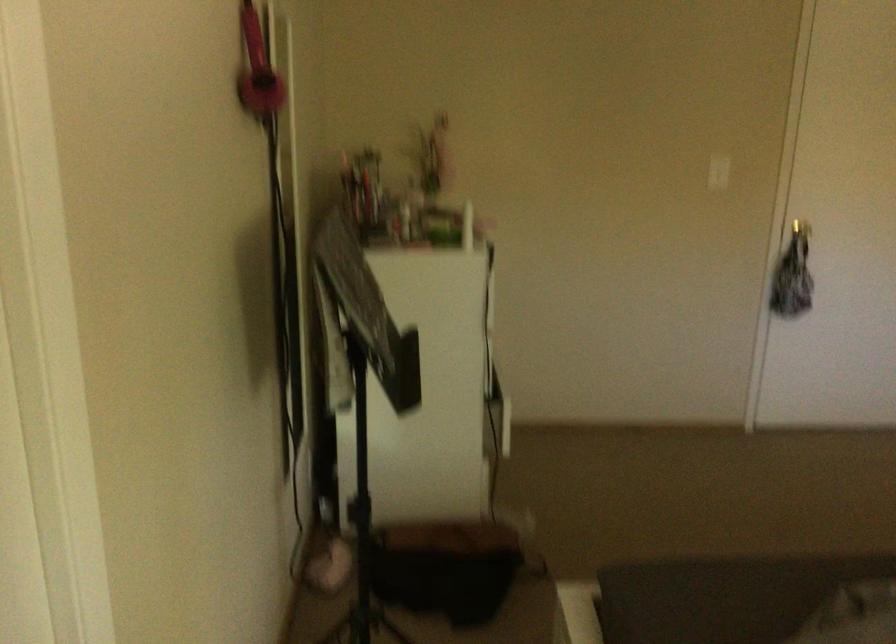
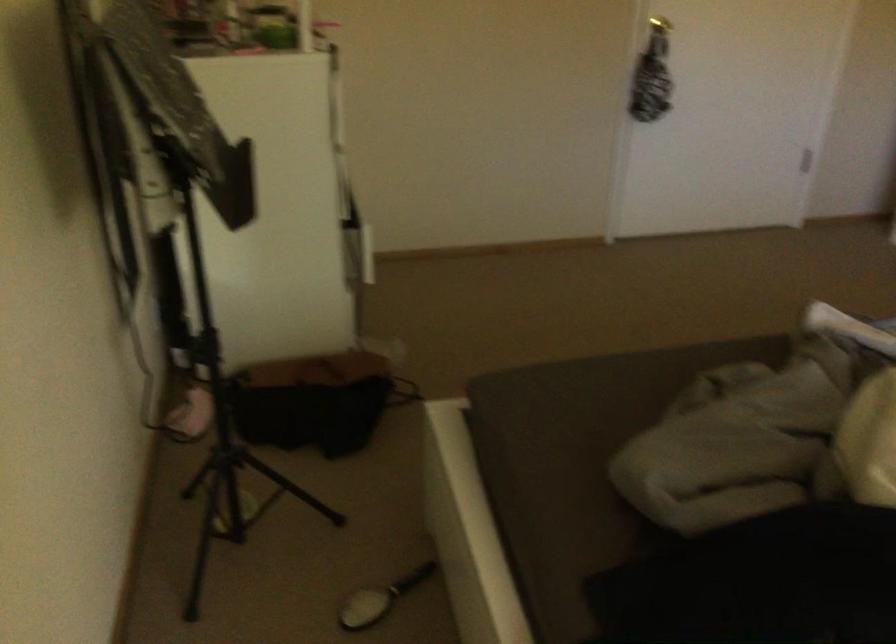
The point at (803,277) is marked in the first image. Where is the corresponding point in the second image?

(649, 87)